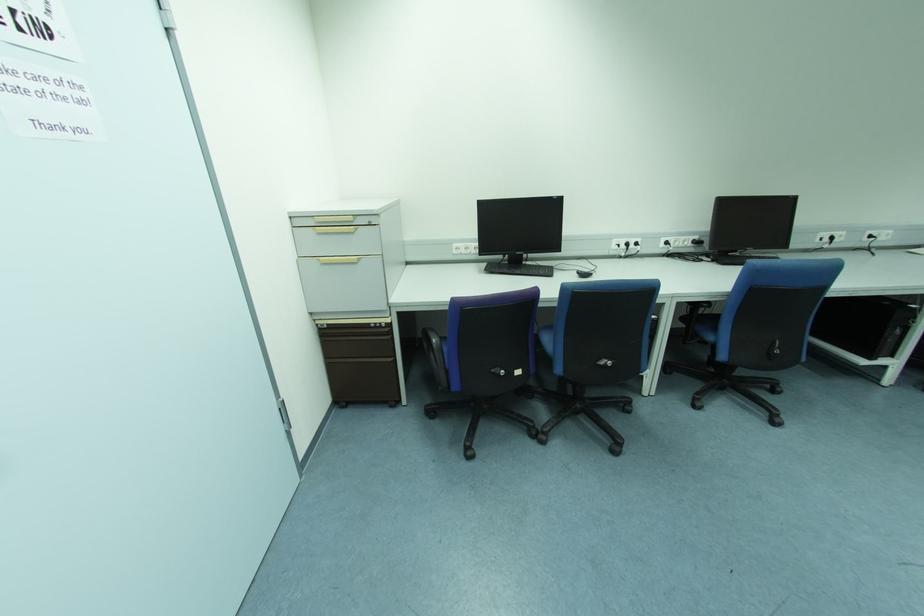
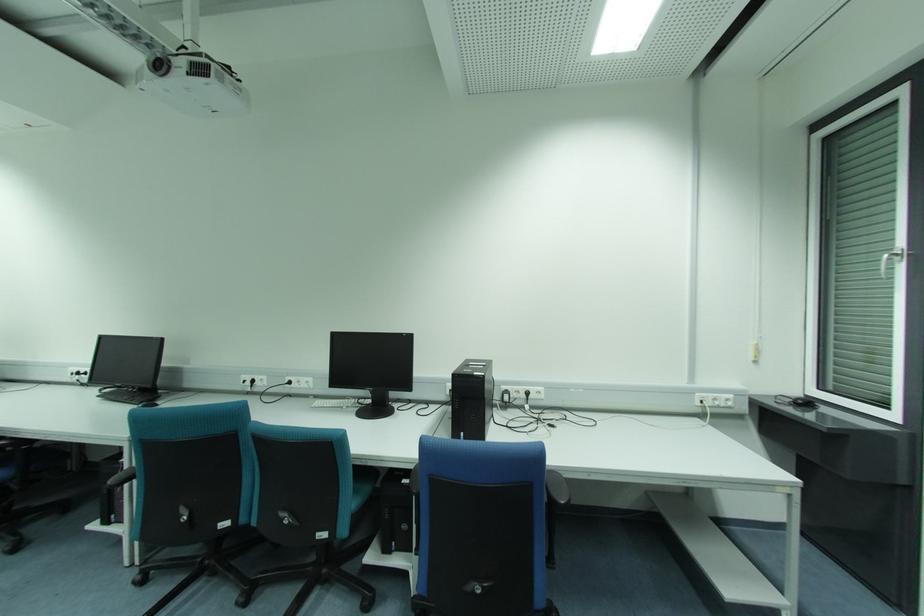
The point at (833, 238) is marked in the first image. Where is the corresponding point in the second image?

(253, 381)